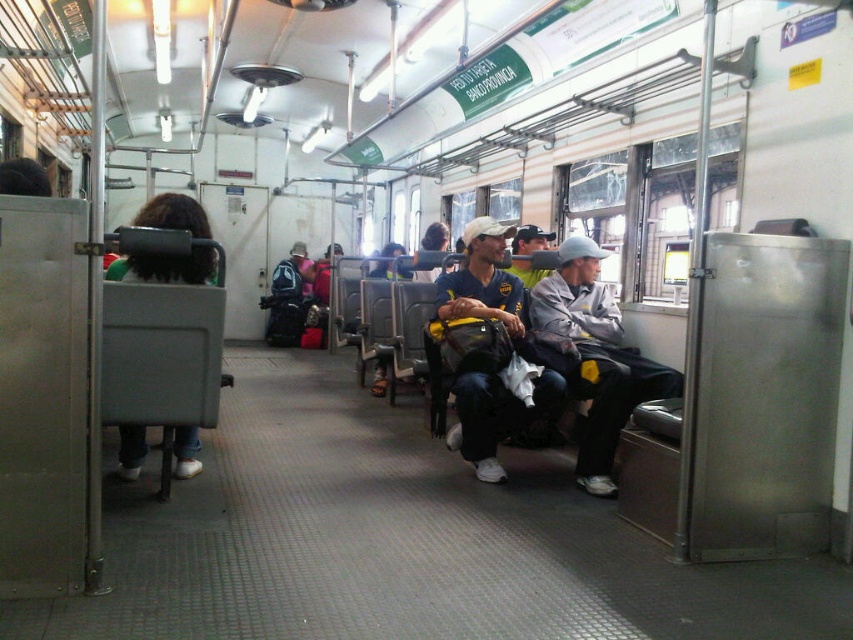
Does gray fabric jacket at center have a lesser width compared to matte blue cap at center?

No, gray fabric jacket at center is not thinner than matte blue cap at center.

Is gray fabric jacket at center to the left of matte blue cap at center from the viewer's perspective?

Incorrect, gray fabric jacket at center is not on the left side of matte blue cap at center.

What do you see at coordinates (596, 356) in the screenshot? I see `gray fabric jacket at center` at bounding box center [596, 356].

The width and height of the screenshot is (853, 640). I want to click on gray fabric jacket at center, so click(x=596, y=356).

Who is positioned more to the left, matte blue shirt at center or green fabric backpack at left?

Positioned to the left is green fabric backpack at left.

Is matte blue shirt at center below green fabric backpack at left?

Actually, matte blue shirt at center is above green fabric backpack at left.

Identify the location of matte blue shirt at center. The height and width of the screenshot is (640, 853). point(483,280).

Which is above, gray fabric jacket at center or matte blue shirt at center?

matte blue shirt at center is higher up.

Does gray fabric jacket at center have a lesser height compared to matte blue shirt at center?

Incorrect, gray fabric jacket at center's height does not fall short of matte blue shirt at center's.

This screenshot has width=853, height=640. Describe the element at coordinates (596, 356) in the screenshot. I see `gray fabric jacket at center` at that location.

This screenshot has height=640, width=853. I want to click on gray fabric jacket at center, so click(596, 356).